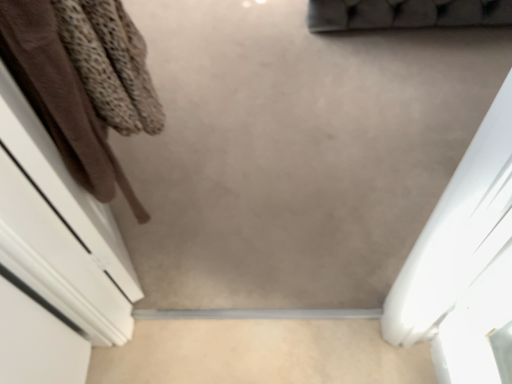
Question: Based on their sizes in the image, would you say beige matte concrete at center is bigger or smaller than brown fabric at left?

Choices:
 (A) small
 (B) big

Answer: (A)

Question: From a real-world perspective, is beige matte concrete at center above or below brown fabric at left?

Choices:
 (A) above
 (B) below

Answer: (B)

Question: Is point (x=275, y=319) positioned closer to the camera than point (x=40, y=72)?

Choices:
 (A) closer
 (B) farther

Answer: (B)

Question: From the image's perspective, is brown fabric at left positioned above or below beige matte concrete at center?

Choices:
 (A) above
 (B) below

Answer: (A)

Question: Is point (70, 86) closer or farther from the camera than point (324, 362)?

Choices:
 (A) closer
 (B) farther

Answer: (A)

Question: Considering their positions, is brown fabric at left located in front of or behind beige matte concrete at center?

Choices:
 (A) front
 (B) behind

Answer: (A)

Question: Considering the positions of brown fabric at left and beige matte concrete at center in the image, is brown fabric at left bigger or smaller than beige matte concrete at center?

Choices:
 (A) small
 (B) big

Answer: (B)